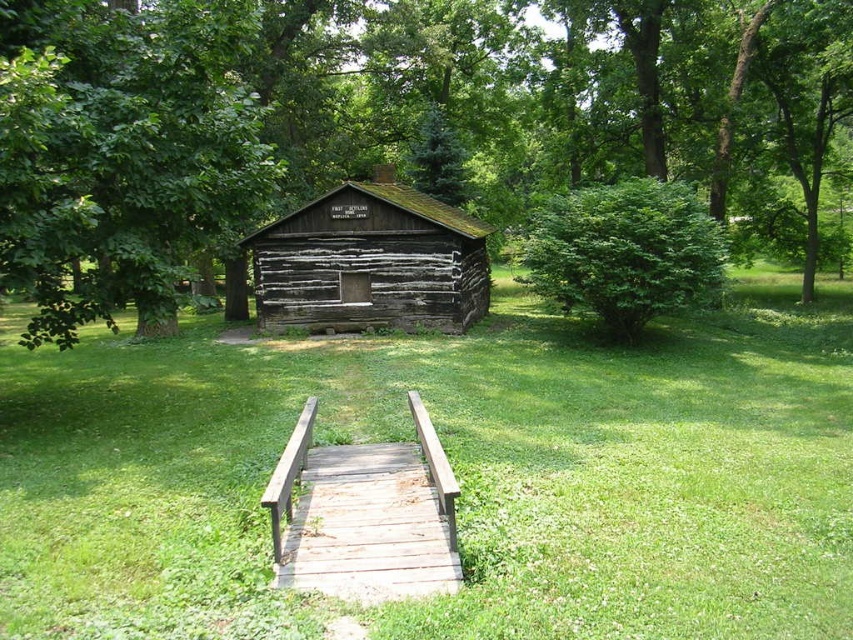
Is weathered wood rail at center bigger than green leafy bush at center right?

No.

Does weathered wood rail at center appear on the right side of green leafy bush at center right?

Incorrect, weathered wood rail at center is not on the right side of green leafy bush at center right.

Locate an element on the screen. This screenshot has width=853, height=640. weathered wood rail at center is located at coordinates (364, 515).

Is green leafy tree at center smaller than dark brown wooden log cabin at center?

No.

Is green leafy tree at center further to camera compared to dark brown wooden log cabin at center?

No.

Does point (457, 42) come closer to viewer compared to point (415, 294)?

No, it is behind (415, 294).

Find the location of a particular element. The width and height of the screenshot is (853, 640). green leafy tree at center is located at coordinates (405, 147).

Who is more forward, (321, 228) or (328, 577)?

Point (328, 577) is in front.

In order to click on dark brown wooden log cabin at center in this screenshot , I will do `click(370, 262)`.

Identify the location of dark brown wooden log cabin at center. The image size is (853, 640). (370, 262).

This screenshot has height=640, width=853. What are the coordinates of `dark brown wooden log cabin at center` in the screenshot? It's located at (370, 262).